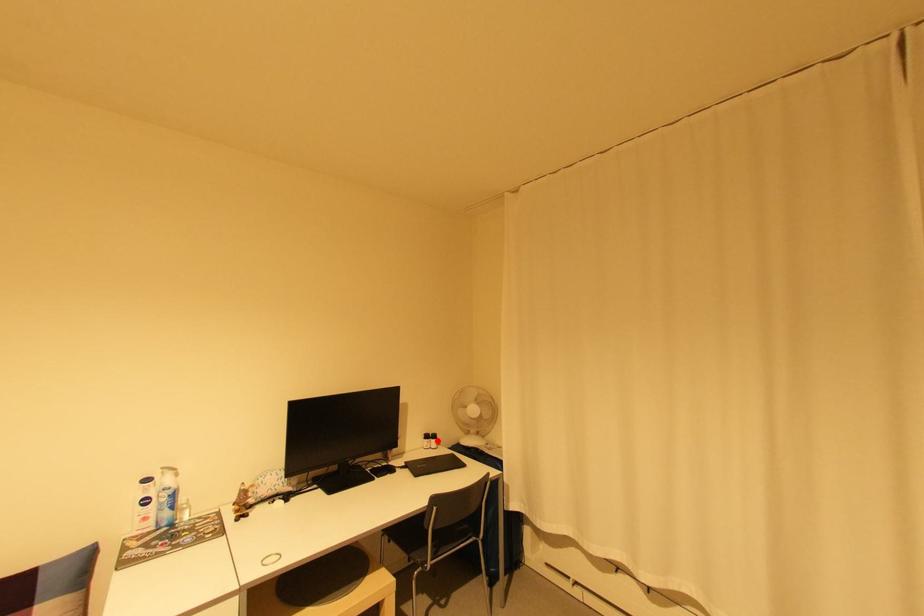
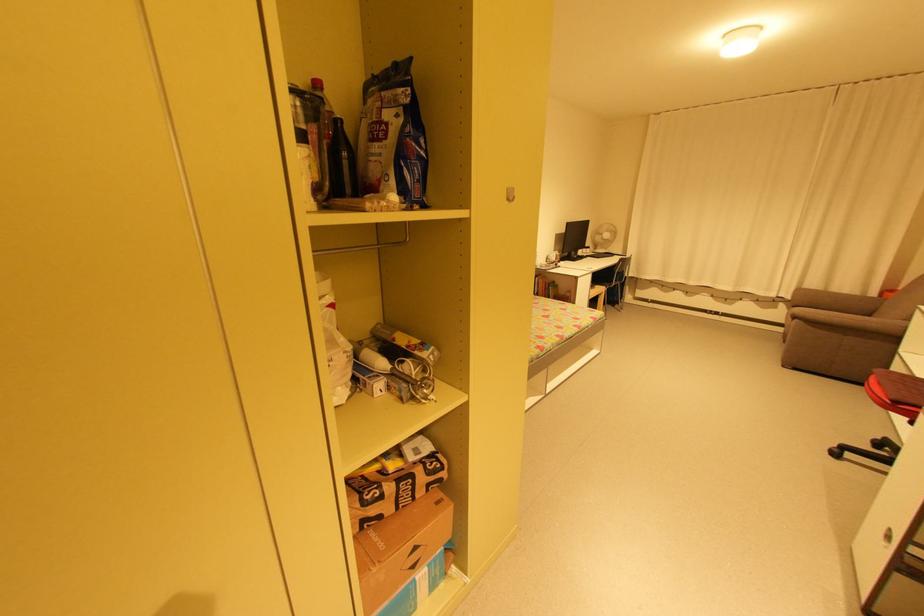
Locate, in the second image, the point that corresponds to the highlighted location in the first image.

(592, 249)